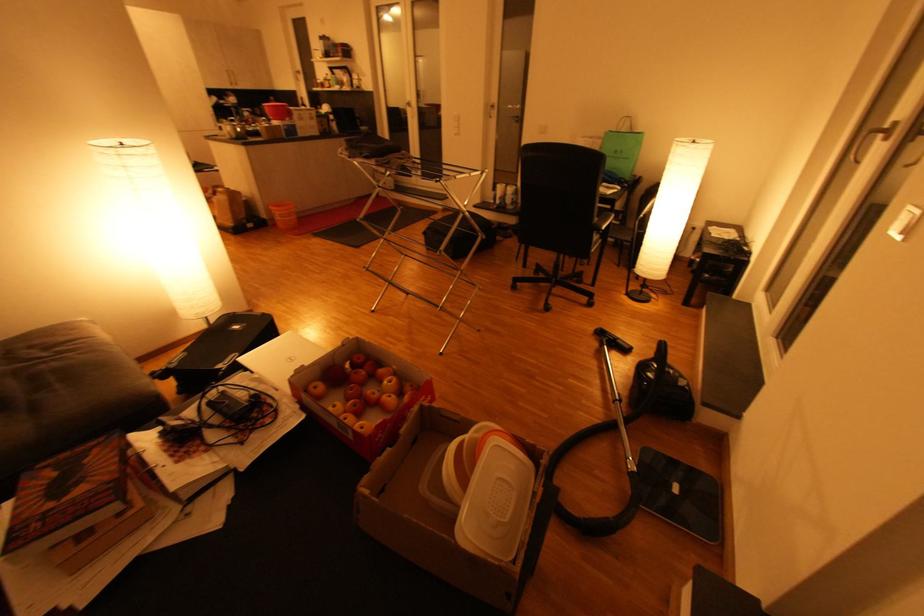
This screenshot has width=924, height=616. What do you see at coordinates (634, 139) in the screenshot?
I see `the green bag handle` at bounding box center [634, 139].